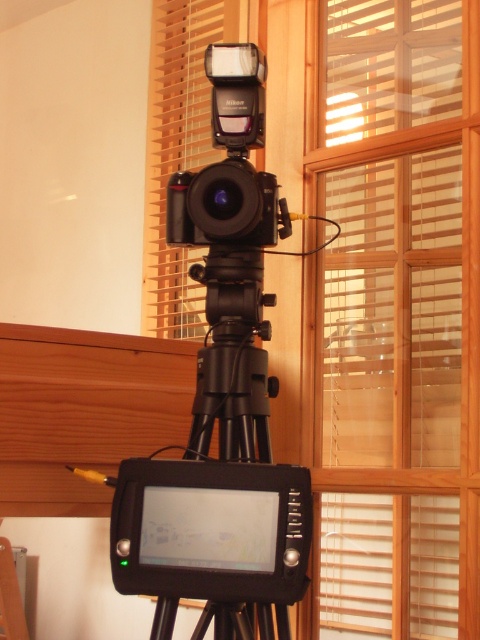
Is wooden blinds at center further to the viewer compared to black matte camera at center?

No, wooden blinds at center is in front of black matte camera at center.

Looking at this image, does wooden blinds at center have a greater height compared to black matte camera at center?

Yes, wooden blinds at center is taller than black matte camera at center.

Between point (354, 467) and point (262, 125), which one is positioned in front?

Positioned in front is point (262, 125).

What are the coordinates of `wooden blinds at center` in the screenshot? It's located at (x=395, y=310).